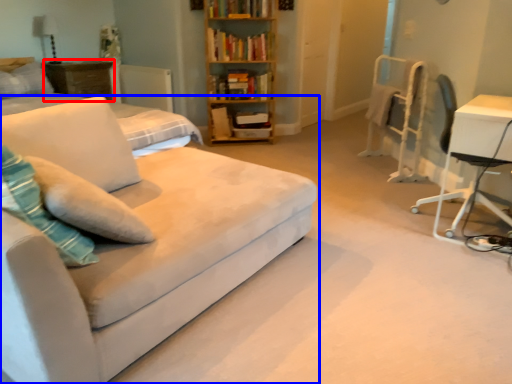
Question: Which object is closer to the camera taking this photo, table (highlighted by a red box) or studio couch (highlighted by a blue box)?

Choices:
 (A) table
 (B) studio couch

Answer: (B)